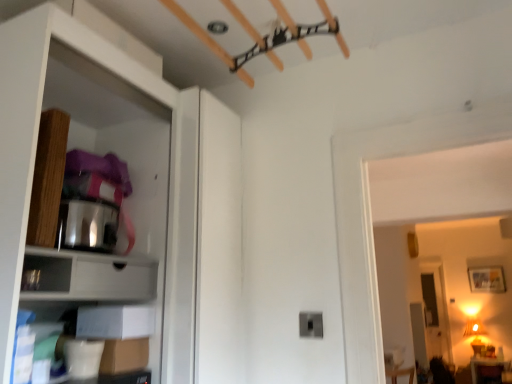
Question: Can you confirm if matte white cabinet at left is taller than white matte cabinet at lower left?

Choices:
 (A) no
 (B) yes

Answer: (B)

Question: Is matte white cabinet at left positioned beyond the bounds of white matte cabinet at lower left?

Choices:
 (A) no
 (B) yes

Answer: (B)

Question: Does matte white cabinet at left turn towards white matte cabinet at lower left?

Choices:
 (A) no
 (B) yes

Answer: (B)

Question: From a real-world perspective, is matte white cabinet at left positioned under white matte cabinet at lower left based on gravity?

Choices:
 (A) no
 (B) yes

Answer: (A)

Question: Considering the relative sizes of matte white cabinet at left and white matte cabinet at lower left in the image provided, is matte white cabinet at left smaller than white matte cabinet at lower left?

Choices:
 (A) no
 (B) yes

Answer: (A)

Question: In terms of height, does white matte cabinet at lower left look taller or shorter compared to matte black drawer at lower left?

Choices:
 (A) tall
 (B) short

Answer: (A)

Question: From a real-world perspective, is white matte cabinet at lower left physically located above or below matte black drawer at lower left?

Choices:
 (A) below
 (B) above

Answer: (B)

Question: From the image's perspective, is white matte cabinet at lower left above or below matte black drawer at lower left?

Choices:
 (A) below
 (B) above

Answer: (A)

Question: Considering the positions of white matte cabinet at lower left and matte black drawer at lower left in the image, is white matte cabinet at lower left wider or thinner than matte black drawer at lower left?

Choices:
 (A) thin
 (B) wide

Answer: (B)

Question: From the image's perspective, is matte brown cushion at lower right positioned above or below white matte cabinet at lower left?

Choices:
 (A) above
 (B) below

Answer: (B)

Question: Is matte brown cushion at lower right wider or thinner than white matte cabinet at lower left?

Choices:
 (A) thin
 (B) wide

Answer: (B)

Question: Looking at the image, does matte brown cushion at lower right seem bigger or smaller compared to white matte cabinet at lower left?

Choices:
 (A) big
 (B) small

Answer: (A)

Question: From a real-world perspective, relative to white matte cabinet at lower left, is matte brown cushion at lower right vertically above or below?

Choices:
 (A) below
 (B) above

Answer: (A)

Question: Is matte white cabinet at left spatially inside white matte cabinet at lower left, or outside of it?

Choices:
 (A) inside
 (B) outside

Answer: (B)

Question: From a real-world perspective, is matte white cabinet at left physically located above or below white matte cabinet at lower left?

Choices:
 (A) below
 (B) above

Answer: (B)